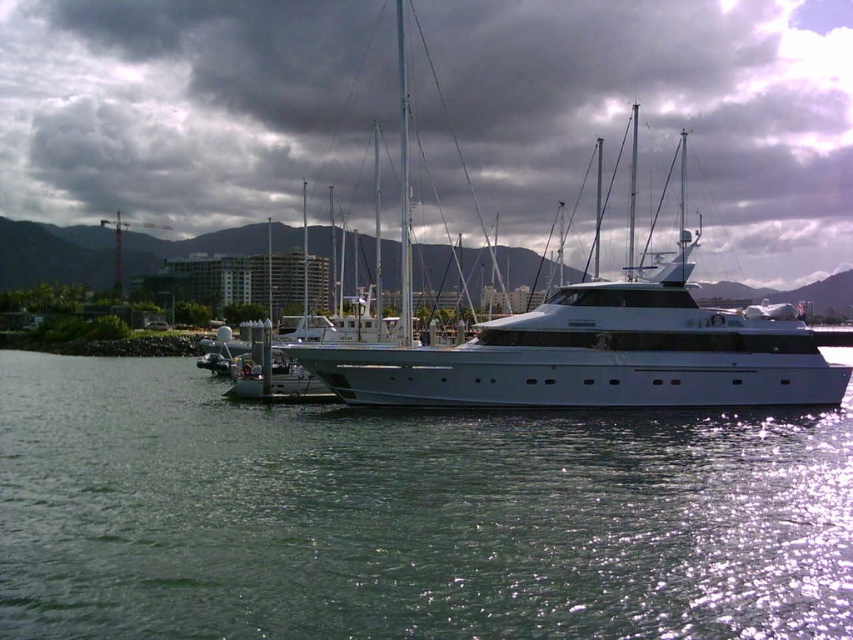
Question: Which object appears closest to the camera in this image?

Choices:
 (A) dark gray cloud at upper center
 (B) green water at lower center

Answer: (B)

Question: Estimate the real-world distances between objects in this image. Which object is farther from the dark gray cloud at upper center?

Choices:
 (A) green water at lower center
 (B) white glossy yacht at center

Answer: (A)

Question: Is dark gray cloud at upper center behind white glossy yacht at center?

Choices:
 (A) no
 (B) yes

Answer: (B)

Question: Can you confirm if dark gray cloud at upper center is smaller than white glossy yacht at center?

Choices:
 (A) no
 (B) yes

Answer: (B)

Question: Can you confirm if green water at lower center is wider than dark gray cloud at upper center?

Choices:
 (A) yes
 (B) no

Answer: (B)

Question: Which of the following is the farthest from the observer?

Choices:
 (A) dark gray cloud at upper center
 (B) white glossy yacht at center

Answer: (A)